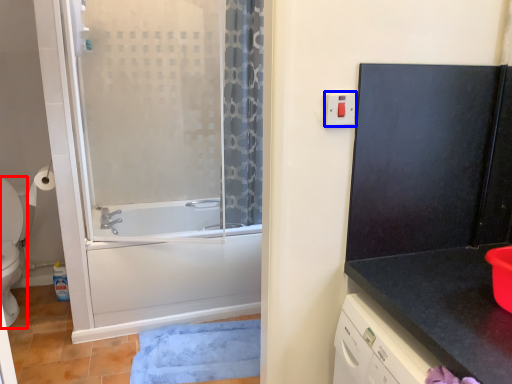
Question: Which object appears farthest to the camera in this image, toilet (highlighted by a red box) or electric outlet (highlighted by a blue box)?

Choices:
 (A) toilet
 (B) electric outlet

Answer: (A)